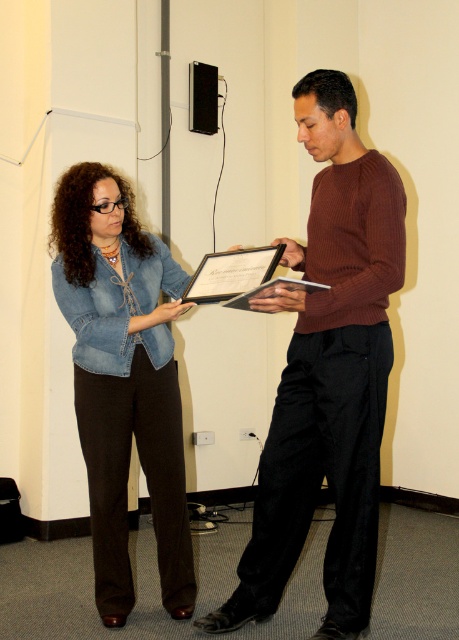
Question: Is brown ribbed sweater at center to the left of denim jacket at center from the viewer's perspective?

Choices:
 (A) yes
 (B) no

Answer: (B)

Question: Is brown ribbed sweater at center wider than denim jacket at center?

Choices:
 (A) no
 (B) yes

Answer: (B)

Question: Among these objects, which one is nearest to the camera?

Choices:
 (A) brown ribbed sweater at center
 (B) denim jacket at center

Answer: (A)

Question: Does brown ribbed sweater at center have a greater width compared to denim jacket at center?

Choices:
 (A) yes
 (B) no

Answer: (A)

Question: Which point is farther to the camera?

Choices:
 (A) (171, 465)
 (B) (302, 99)

Answer: (A)

Question: Which point appears farthest from the camera in this image?

Choices:
 (A) (129, 362)
 (B) (365, 397)

Answer: (A)